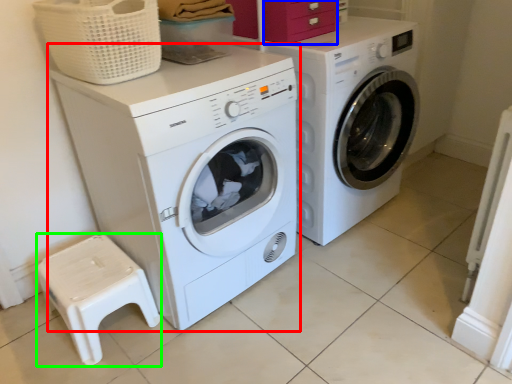
Question: Considering the real-world distances, which object is closest to washing machine (highlighted by a red box)? drawer (highlighted by a blue box) or step stool (highlighted by a green box).

Choices:
 (A) drawer
 (B) step stool

Answer: (B)